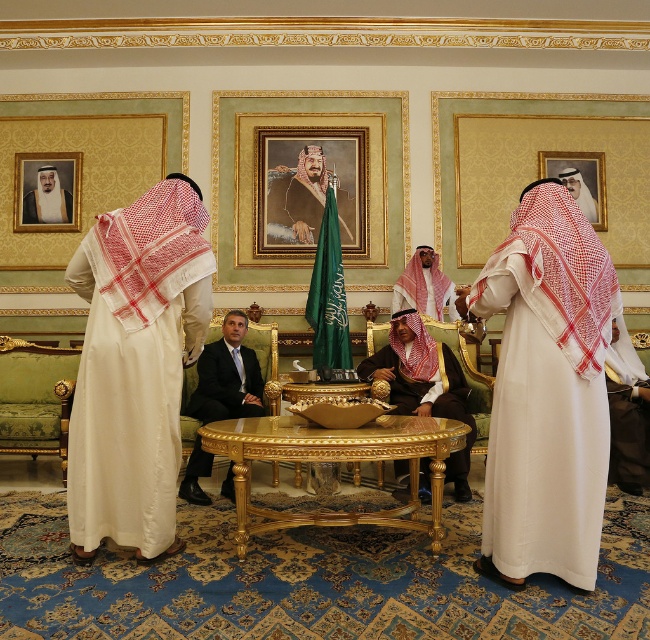
At what (x,y) coordinates should I click in order to perform the action: click on gold-framed portrait at upper center. Please return your answer as a coordinate pair (x, y). The width and height of the screenshot is (650, 640). Looking at the image, I should click on (46, 192).

Between point (62, 198) and point (590, 160), which one is positioned in front?

Positioned in front is point (62, 198).

In the scene shown: Who is more forward, (x=79, y=170) or (x=592, y=212)?

Point (x=79, y=170) is more forward.

Where is `gold-framed portrait at upper center`? This screenshot has width=650, height=640. gold-framed portrait at upper center is located at coordinates (46, 192).

Does point (500, 472) come behind point (254, 221)?

No, it is in front of (254, 221).

Does point (474, 312) come closer to viewer compared to point (307, 166)?

That is True.

Identify the location of white woven robe at center. The image size is (650, 640). (547, 390).

Is the position of dark blue suit at center less distant than that of gold-framed portrait at upper center?

That is True.

Is dark blue suit at center behind gold-framed portrait at upper center?

No, dark blue suit at center is in front of gold-framed portrait at upper center.

This screenshot has width=650, height=640. In order to click on dark blue suit at center in this screenshot , I will do `click(228, 376)`.